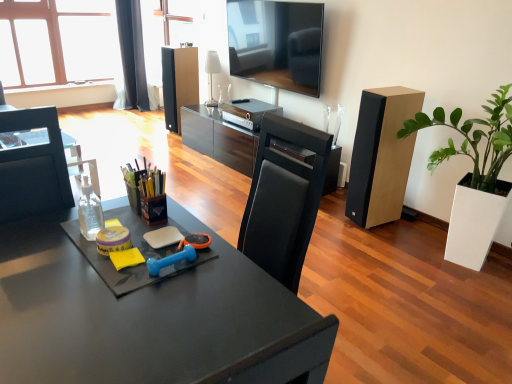
Locate an element on the screen. The image size is (512, 384). free space to the back side of yellow sponge at center is located at coordinates (124, 221).